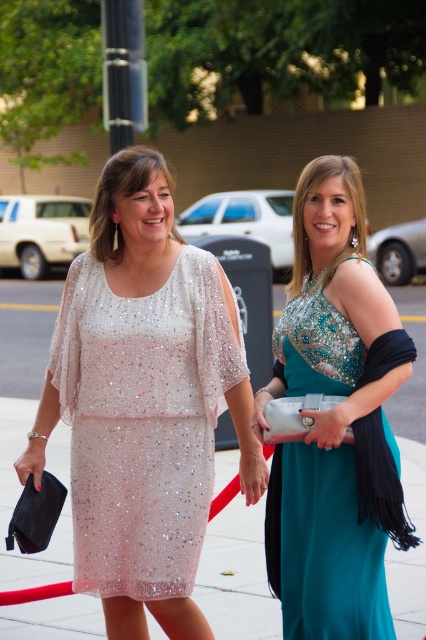
Question: Is teal sequined dress at center to the left of sequined fabric dress at left from the viewer's perspective?

Choices:
 (A) yes
 (B) no

Answer: (B)

Question: Which object is the closest to the sequined fabric dress at left?

Choices:
 (A) pearl sequined dress at center
 (B) teal sequined dress at center

Answer: (B)

Question: Among these objects, which one is nearest to the camera?

Choices:
 (A) sequined fabric dress at left
 (B) pearl sequined dress at center

Answer: (A)

Question: Which point is farther to the camera?

Choices:
 (A) sequined fabric dress at left
 (B) teal sequined dress at center

Answer: (A)

Question: Can you confirm if teal sequined dress at center is thinner than sequined fabric dress at left?

Choices:
 (A) no
 (B) yes

Answer: (B)

Question: Is teal sequined dress at center further to camera compared to pearl sequined dress at center?

Choices:
 (A) no
 (B) yes

Answer: (A)